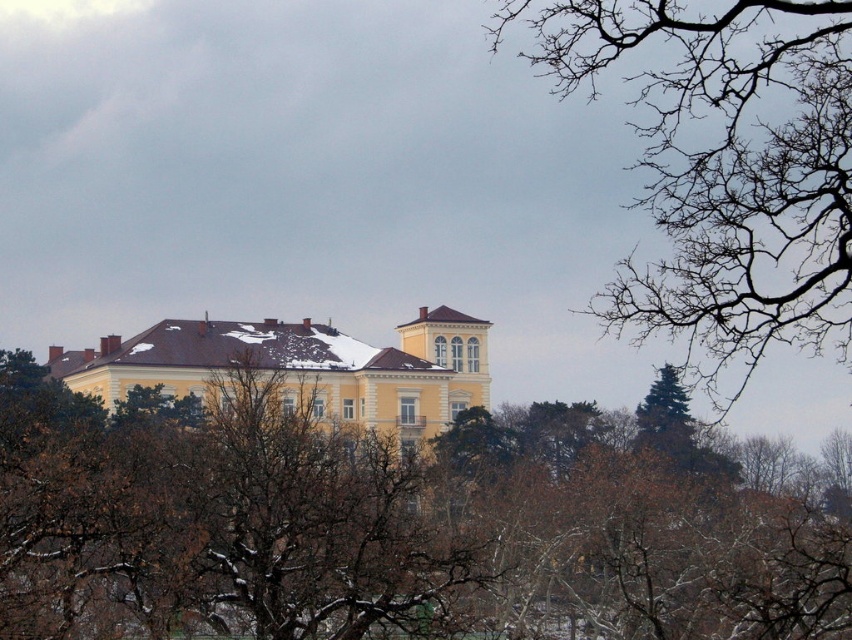
Question: Among these objects, which one is nearest to the camera?

Choices:
 (A) brown leafless branches at upper center
 (B) yellow matte building at center
 (C) bare branches at upper right

Answer: (C)

Question: Does bare branches at upper right appear over yellow matte building at center?

Choices:
 (A) no
 (B) yes

Answer: (B)

Question: Considering the real-world distances, which object is farthest from the bare branches at upper right?

Choices:
 (A) brown leafless branches at upper center
 (B) yellow matte building at center

Answer: (B)

Question: From the image, what is the correct spatial relationship of brown leafless branches at upper center in relation to bare branches at upper right?

Choices:
 (A) right
 (B) left

Answer: (B)

Question: Is brown leafless branches at upper center bigger than yellow matte building at center?

Choices:
 (A) no
 (B) yes

Answer: (B)

Question: Estimate the real-world distances between objects in this image. Which object is closer to the bare branches at upper right?

Choices:
 (A) yellow matte building at center
 (B) brown leafless branches at upper center

Answer: (B)